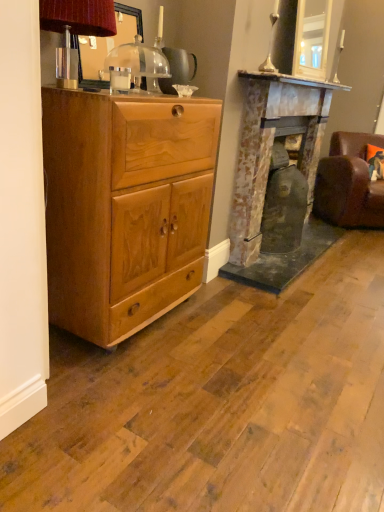
Question: Considering the relative sizes of light brown wood chest of drawers at left and matte brown lampshade at upper left in the image provided, is light brown wood chest of drawers at left wider than matte brown lampshade at upper left?

Choices:
 (A) no
 (B) yes

Answer: (B)

Question: Would you say light brown wood chest of drawers at left is a long distance from matte brown lampshade at upper left?

Choices:
 (A) yes
 (B) no

Answer: (B)

Question: From the image's perspective, is light brown wood chest of drawers at left beneath matte brown lampshade at upper left?

Choices:
 (A) no
 (B) yes

Answer: (B)

Question: Is light brown wood chest of drawers at left bigger than matte brown lampshade at upper left?

Choices:
 (A) no
 (B) yes

Answer: (B)

Question: Does light brown wood chest of drawers at left turn towards matte brown lampshade at upper left?

Choices:
 (A) no
 (B) yes

Answer: (A)

Question: From a real-world perspective, is light brown wood chest of drawers at left positioned over matte brown lampshade at upper left based on gravity?

Choices:
 (A) yes
 (B) no

Answer: (B)

Question: Is matte brown lampshade at upper left next to light brown wood chest of drawers at left and touching it?

Choices:
 (A) yes
 (B) no

Answer: (B)

Question: Is matte brown lampshade at upper left wider than light brown wood chest of drawers at left?

Choices:
 (A) no
 (B) yes

Answer: (A)

Question: Is matte brown lampshade at upper left far away from light brown wood chest of drawers at left?

Choices:
 (A) no
 (B) yes

Answer: (A)

Question: From a real-world perspective, is matte brown lampshade at upper left on light brown wood chest of drawers at left?

Choices:
 (A) yes
 (B) no

Answer: (A)

Question: From the image's perspective, does matte brown lampshade at upper left appear higher than light brown wood chest of drawers at left?

Choices:
 (A) no
 (B) yes

Answer: (B)

Question: Considering the relative sizes of matte brown lampshade at upper left and light brown wood chest of drawers at left in the image provided, is matte brown lampshade at upper left taller than light brown wood chest of drawers at left?

Choices:
 (A) yes
 (B) no

Answer: (B)

Question: Does brown leather swivel chair at right have a smaller size compared to light brown wood chest of drawers at left?

Choices:
 (A) no
 (B) yes

Answer: (A)